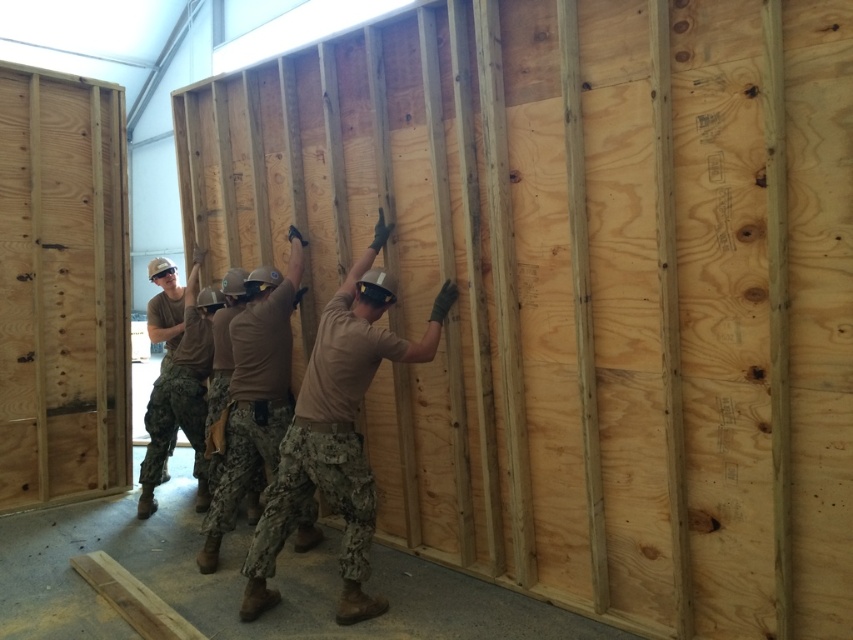
Can you confirm if camouflage uniform at center is shorter than tan/camo uniform at center?

Incorrect, camouflage uniform at center's height does not fall short of tan/camo uniform at center's.

In the scene shown: Can you confirm if camouflage uniform at center is positioned above tan/camo uniform at center?

No.

Does point (252, 282) lie behind point (201, 417)?

That is False.

Image resolution: width=853 pixels, height=640 pixels. I want to click on camouflage uniform at center, so click(254, 392).

The width and height of the screenshot is (853, 640). Identify the location of tan matte uniform at center. (337, 433).

Who is positioned more to the right, tan matte uniform at center or camouflage uniform at center?

Positioned to the right is tan matte uniform at center.

The image size is (853, 640). What are the coordinates of `tan matte uniform at center` in the screenshot? It's located at (337, 433).

Find the location of a particular element. The width and height of the screenshot is (853, 640). tan matte uniform at center is located at coordinates (337, 433).

Which of these two, tan matte uniform at center or tan/camo uniform at center, stands shorter?

Standing shorter between the two is tan/camo uniform at center.

Who is positioned more to the left, tan matte uniform at center or tan/camo uniform at center?

Positioned to the left is tan/camo uniform at center.

Describe the element at coordinates (337, 433) in the screenshot. This screenshot has width=853, height=640. I see `tan matte uniform at center` at that location.

Find the location of a particular element. This screenshot has width=853, height=640. tan matte uniform at center is located at coordinates (337, 433).